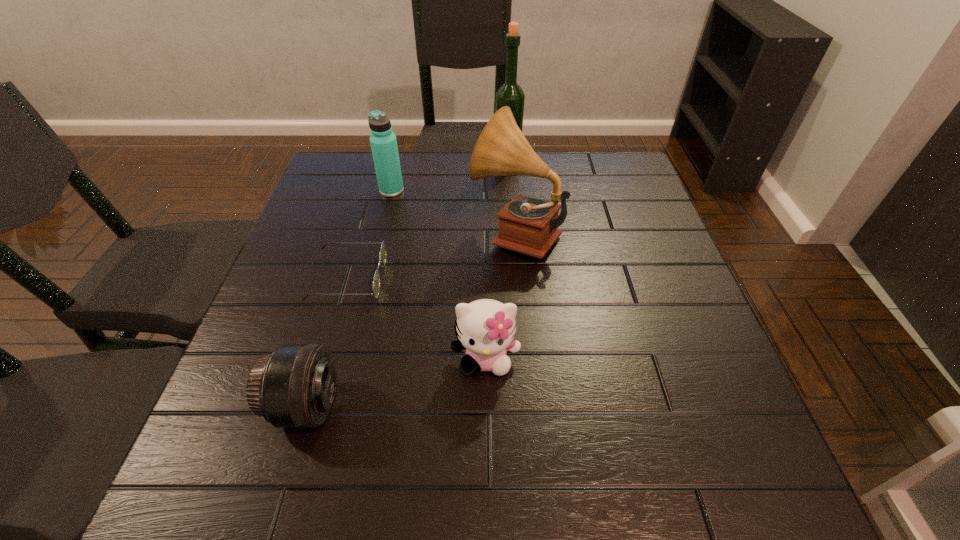
What are the coordinates of `vacant space located on the horn of the phonograph record` in the screenshot? It's located at (450, 233).

The width and height of the screenshot is (960, 540). I want to click on free space located 0.290m on the horn of the phonograph record, so click(x=355, y=233).

The width and height of the screenshot is (960, 540). What are the coordinates of `free point located on the front of the third tallest object` in the screenshot? It's located at (386, 213).

Locate an element on the screen. The image size is (960, 540). blank space located 0.170m on the front-facing side of the kitten is located at coordinates (487, 476).

Locate an element on the screen. free space located on the front-facing side of the telephoto lens is located at coordinates (474, 405).

At what (x,y) coordinates should I click in order to perform the action: click on free region located on the front-facing side of the shortest object. Please return your answer as a coordinate pair (x, y). This screenshot has height=540, width=960. Looking at the image, I should click on (462, 278).

At what (x,y) coordinates should I click in order to perform the action: click on liquor at the far edge. Please return your answer as a coordinate pair (x, y). This screenshot has height=540, width=960. Looking at the image, I should click on (510, 94).

The image size is (960, 540). I want to click on thermos bottle that is positioned at the far edge, so click(383, 141).

Locate an element on the screen. telephoto lens at the left edge is located at coordinates (293, 387).

Find the location of a particular element. sunglasses that is at the left edge is located at coordinates (382, 258).